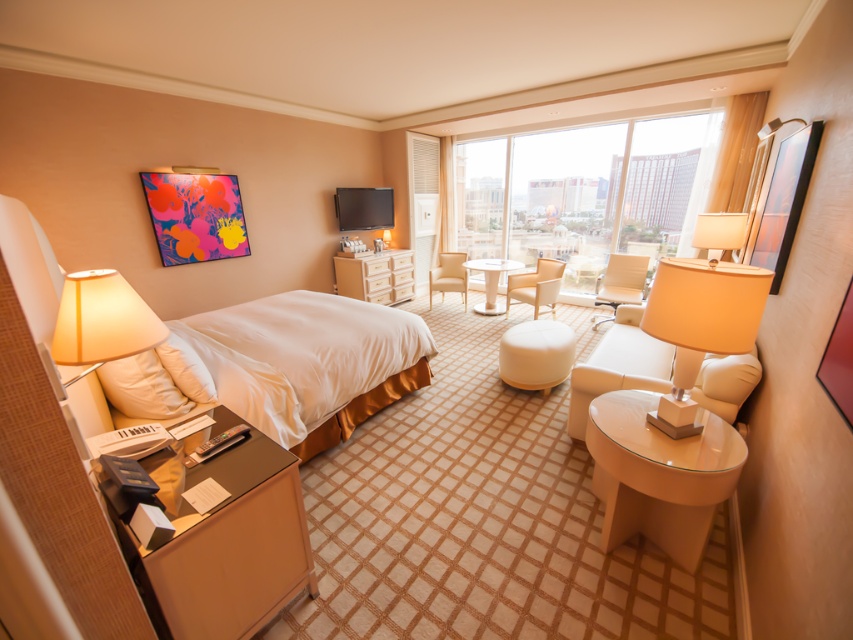
Looking at this image, you are a hotel guest who wants to place a 2.0 meter long luggage on the floor between the white fabric stool at center and the white glossy table at center. Is there enough space for the luggage to fit without overlapping either object?

The distance between the white fabric stool at center and the white glossy table at center is 1.96 meters, which is slightly shorter than the 2.0 meter long luggage. Therefore, the luggage will not fit without overlapping one of the objects.

You are a guest in the hotel room and want to place a small lamp on the white fabric stool at center and the beige fabric armchair at center. Which object is positioned to the right side of the other?

The white fabric stool at center is to the right of the beige fabric armchair at center.